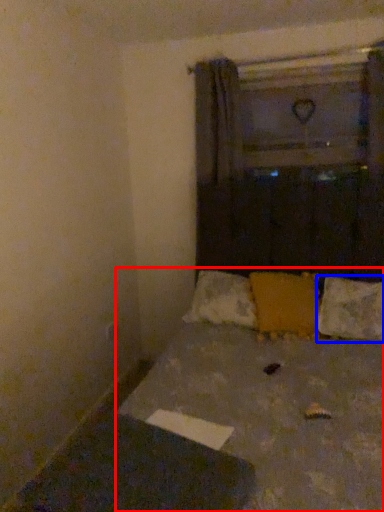
Question: Among these objects, which one is farthest to the camera, bed (highlighted by a red box) or pillow (highlighted by a blue box)?

Choices:
 (A) bed
 (B) pillow

Answer: (B)